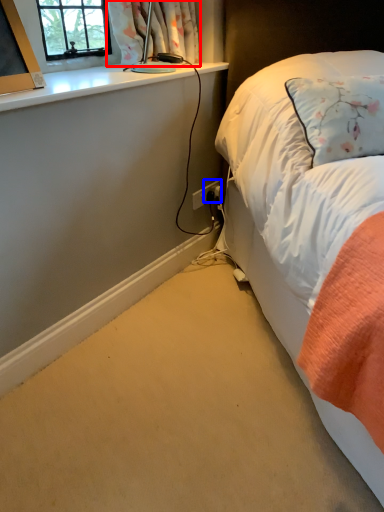
Question: Which of the following is the farthest to the observer, curtain (highlighted by a red box) or power plugs and sockets (highlighted by a blue box)?

Choices:
 (A) curtain
 (B) power plugs and sockets

Answer: (B)